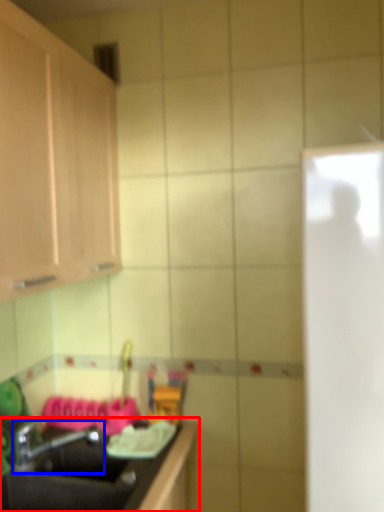
Question: Which point is further to the camera, countertop (highlighted by a red box) or tap (highlighted by a blue box)?

Choices:
 (A) countertop
 (B) tap

Answer: (B)